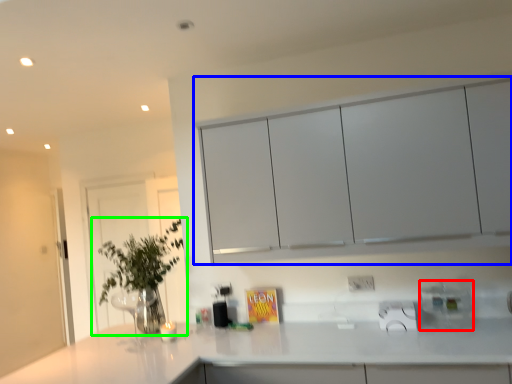
Question: Which object is the closest to the appliance (highlighted by a red box)? Choose among these: cabinetry (highlighted by a blue box) or houseplant (highlighted by a green box).

Choices:
 (A) cabinetry
 (B) houseplant

Answer: (A)